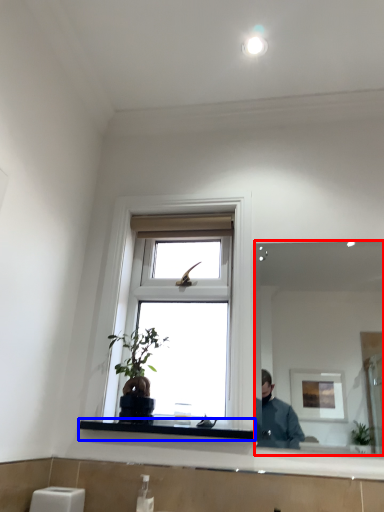
Question: Which point is further to the camera, mirror (highlighted by a red box) or window sill (highlighted by a blue box)?

Choices:
 (A) mirror
 (B) window sill

Answer: (B)